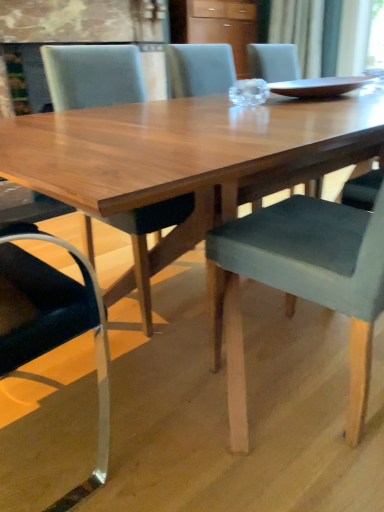
Identify the location of vacant area that lies in front of matte gray chair at center, the first chair when ordered from left to right. The image size is (384, 512). (159, 366).